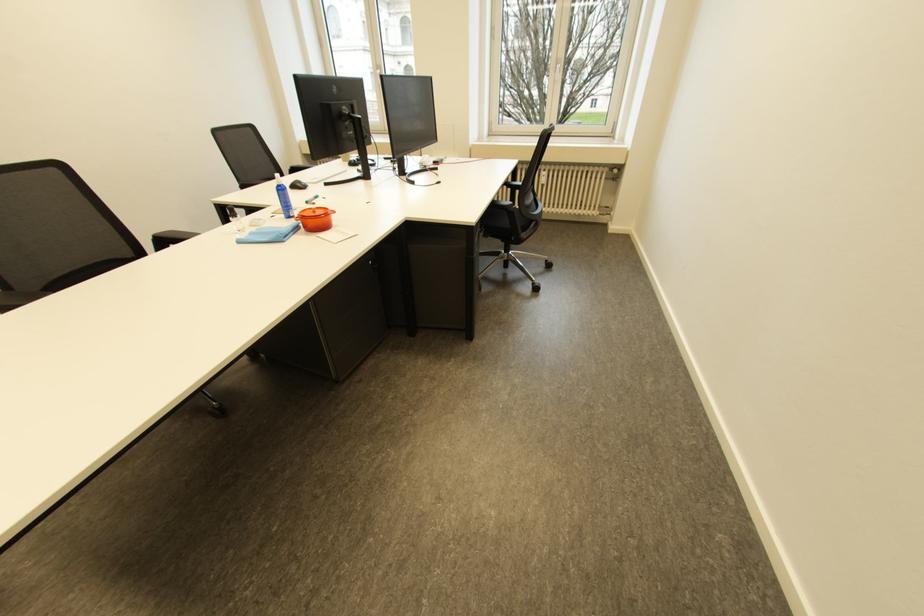
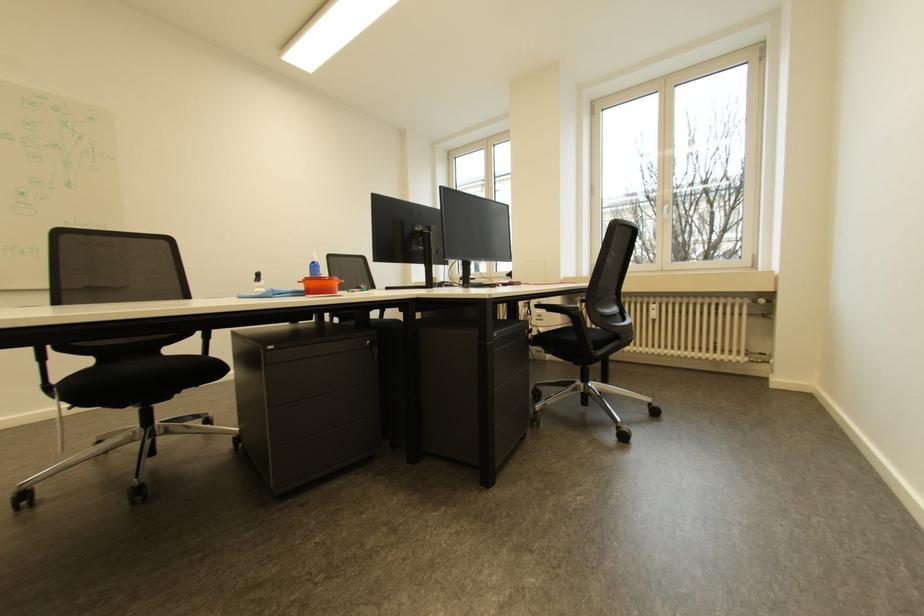
The point at (565, 68) is marked in the first image. Where is the corresponding point in the second image?

(672, 209)